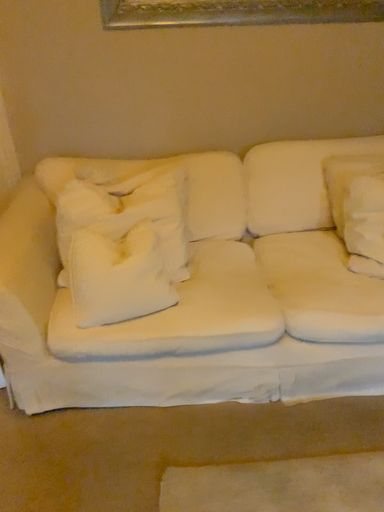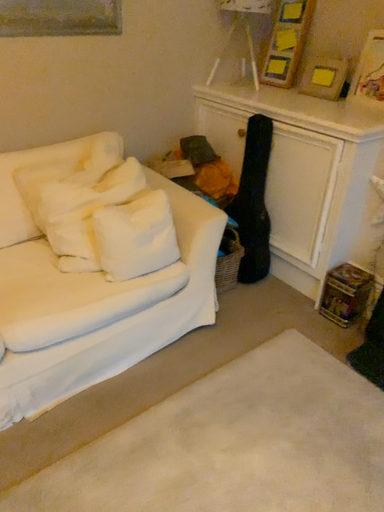
Question: How did the camera likely rotate when shooting the video?

Choices:
 (A) rotated left
 (B) rotated right

Answer: (B)